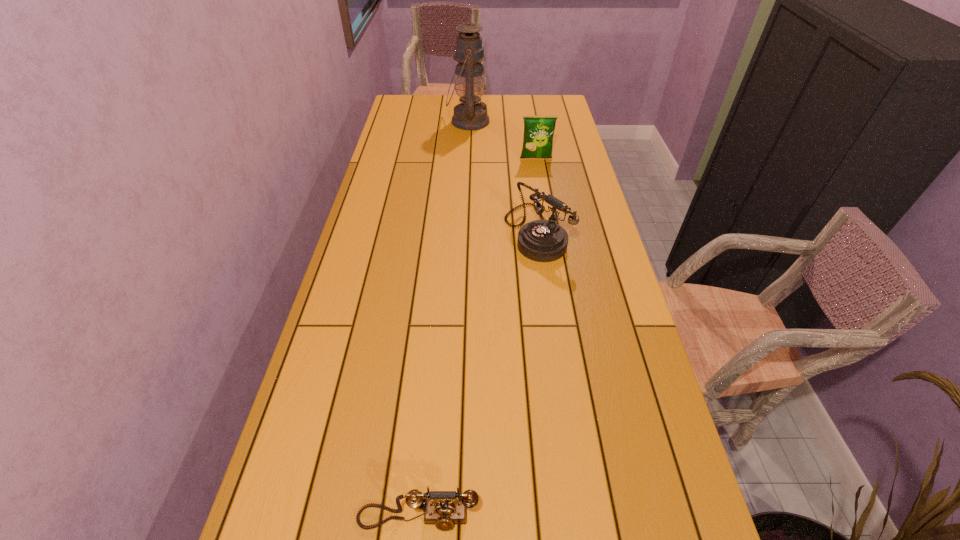
You are a GUI agent. You are given a task and a screenshot of the screen. Output one action in this format:
    pyautogui.click(x=<x>, y=<y>)
    Task: Click on the oil lamp
    This screenshot has height=540, width=960.
    Given the screenshot: What is the action you would take?
    pyautogui.click(x=469, y=53)

Where is `the farthest object`? The image size is (960, 540). the farthest object is located at coordinates click(x=469, y=53).

Locate an element on the screen. The height and width of the screenshot is (540, 960). the second farthest object is located at coordinates (538, 130).

At what (x,y) coordinates should I click in order to perform the action: click on the right telephone. Please return your answer as a coordinate pair (x, y). The height and width of the screenshot is (540, 960). Looking at the image, I should click on (543, 240).

This screenshot has width=960, height=540. What are the coordinates of `the farther telephone` in the screenshot? It's located at (543, 240).

This screenshot has width=960, height=540. Find the location of `the shortest object`. the shortest object is located at coordinates (444, 514).

I want to click on the nearest object, so click(x=444, y=514).

The height and width of the screenshot is (540, 960). What are the coordinates of `free space located 0.090m on the back of the farthest object` in the screenshot? It's located at (469, 100).

Locate an element on the screen. The image size is (960, 540). vacant space located 0.250m on the front-facing side of the third nearest object is located at coordinates (543, 200).

Find the location of a particular element. The width and height of the screenshot is (960, 540). vacant point located 0.260m on the front of the farther telephone is located at coordinates (551, 333).